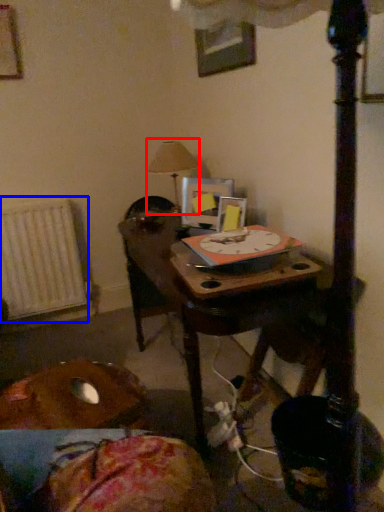
Question: Among these objects, which one is nearest to the camera, table lamp (highlighted by a red box) or radiator (highlighted by a blue box)?

Choices:
 (A) table lamp
 (B) radiator

Answer: (A)